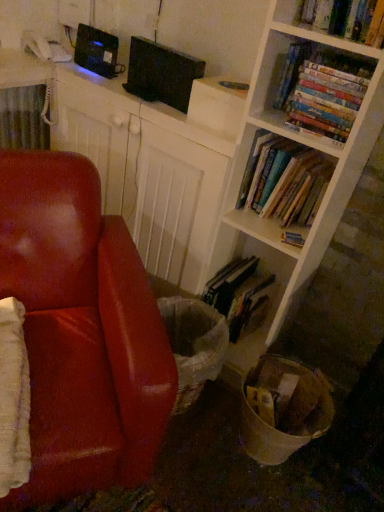
Locate an element on the screen. This screenshot has width=384, height=512. hardcover book at center, which ranks as the third book in top-to-bottom order is located at coordinates (292, 239).

The width and height of the screenshot is (384, 512). In order to click on hardcover books at upper right, acting as the fourth book starting from the bottom in this screenshot , I will do `click(322, 89)`.

Describe the element at coordinates (81, 330) in the screenshot. I see `leather at left` at that location.

Describe the element at coordinates (287, 181) in the screenshot. This screenshot has width=384, height=512. I see `hardcover books at center right, arranged as the 2th book when viewed from the top` at that location.

I want to click on black matte computer at upper center, so (x=152, y=165).

What are the coordinates of `computer above the hardcover book at center, the second book in the bottom-to-top sequence (from the image's perspective)` in the screenshot? It's located at (152, 165).

Is hardcover book at center, the second book in the bottom-to-top sequence, located outside black matte computer at upper center?

That's correct, hardcover book at center, the second book in the bottom-to-top sequence, is outside of black matte computer at upper center.

From the image's perspective, relative to black matte computer at upper center, is hardcover book at center, which ranks as the third book in top-to-bottom order, above or below?

From the image's perspective, hardcover book at center, which ranks as the third book in top-to-bottom order, appears below black matte computer at upper center.

Looking at this image, from a real-world perspective, which is physically below, hardcover book at center, the second book in the bottom-to-top sequence, or black matte computer at upper center?

black matte computer at upper center, from a real-world perspective.

From a real-world perspective, is hardcover book at lower center, the first book positioned from the bottom, beneath black matte computer at upper center?

Yes, from a real-world perspective, hardcover book at lower center, the first book positioned from the bottom, is below black matte computer at upper center.

Would you say hardcover book at lower center, which is the 4th book from top to bottom, is inside or outside black matte computer at upper center?

hardcover book at lower center, which is the 4th book from top to bottom, is not inside black matte computer at upper center, it's outside.

The width and height of the screenshot is (384, 512). In order to click on computer in front of the hardcover book at lower center, which is the 4th book from top to bottom in this screenshot , I will do `click(152, 165)`.

Is point (221, 273) closer to viewer compared to point (98, 170)?

No, it is not.

Is leather at left in contact with hardcover book at center, the second book in the bottom-to-top sequence?

leather at left and hardcover book at center, the second book in the bottom-to-top sequence, are not in contact.

At what (x,y) coordinates should I click in order to perform the action: click on chair to the left of hardcover book at center, which ranks as the third book in top-to-bottom order. Please return your answer as a coordinate pair (x, y). Looking at the image, I should click on (81, 330).

Is leather at left at the right side of hardcover book at center, the second book in the bottom-to-top sequence?

No.

Considering the relative positions of leather at left and hardcover book at center, the second book in the bottom-to-top sequence, in the image provided, is leather at left behind hardcover book at center, the second book in the bottom-to-top sequence,?

That is False.

Would you consider hardcover books at upper right, which appears as the 1th book when viewed from the top, to be distant from black matte computer at upper center?

Actually, hardcover books at upper right, which appears as the 1th book when viewed from the top, and black matte computer at upper center are a little close together.

Which is in front, point (292, 69) or point (164, 271)?

The point (292, 69) is closer to the camera.

Could you tell me if hardcover books at upper right, which appears as the 1th book when viewed from the top, is turned towards black matte computer at upper center?

No, hardcover books at upper right, which appears as the 1th book when viewed from the top, is not facing towards black matte computer at upper center.

Considering the relative sizes of hardcover books at upper right, which appears as the 1th book when viewed from the top, and hardcover books at center right, arranged as the 2th book when viewed from the top, in the image provided, is hardcover books at upper right, which appears as the 1th book when viewed from the top, taller than hardcover books at center right, arranged as the 2th book when viewed from the top,?

No.

Between hardcover books at upper right, acting as the fourth book starting from the bottom, and hardcover books at center right, which is counted as the third book, starting from the bottom, which one appears on the right side from the viewer's perspective?

hardcover books at upper right, acting as the fourth book starting from the bottom, is more to the right.

Would you say hardcover books at upper right, which appears as the 1th book when viewed from the top, contains hardcover books at center right, arranged as the 2th book when viewed from the top?

No, hardcover books at center right, arranged as the 2th book when viewed from the top, is located outside of hardcover books at upper right, which appears as the 1th book when viewed from the top.

Considering the positions of point (352, 111) and point (266, 144), is point (352, 111) closer or farther from the camera than point (266, 144)?

Point (352, 111) is closer to the camera than point (266, 144).

Between hardcover books at upper right, acting as the fourth book starting from the bottom, and hardcover book at lower center, which is the 4th book from top to bottom, which one is positioned in front?

hardcover books at upper right, acting as the fourth book starting from the bottom, is more forward.

Can you tell me how much hardcover books at upper right, which appears as the 1th book when viewed from the top, and hardcover book at lower center, which is the 4th book from top to bottom, differ in facing direction?

The facing directions of hardcover books at upper right, which appears as the 1th book when viewed from the top, and hardcover book at lower center, which is the 4th book from top to bottom, are 0.00114 degrees apart.

Who is taller, hardcover books at upper right, acting as the fourth book starting from the bottom, or hardcover book at lower center, which is the 4th book from top to bottom?

With more height is hardcover book at lower center, which is the 4th book from top to bottom.

Who is bigger, hardcover books at upper right, acting as the fourth book starting from the bottom, or hardcover book at lower center, the first book positioned from the bottom?

With larger size is hardcover book at lower center, the first book positioned from the bottom.

Considering the relative positions of leather at left and hardcover books at upper right, acting as the fourth book starting from the bottom, in the image provided, is leather at left to the left of hardcover books at upper right, acting as the fourth book starting from the bottom, from the viewer's perspective?

Correct, you'll find leather at left to the left of hardcover books at upper right, acting as the fourth book starting from the bottom.

Is point (93, 428) positioned after point (362, 68)?

No.

What's the angular difference between leather at left and hardcover books at upper right, which appears as the 1th book when viewed from the top,'s facing directions?

The angular difference between leather at left and hardcover books at upper right, which appears as the 1th book when viewed from the top, is 52.7 degrees.

Does leather at left have a larger size compared to hardcover books at upper right, which appears as the 1th book when viewed from the top?

Correct, leather at left is larger in size than hardcover books at upper right, which appears as the 1th book when viewed from the top.

From a real-world perspective, starting from the black matte computer at upper center, which book is the 1st one vertically above it? Please provide its 2D coordinates.

[(292, 239)]

This screenshot has width=384, height=512. Find the location of `book that is the 2nd one when counting downward from the black matte computer at upper center (from the image's perspective)`. book that is the 2nd one when counting downward from the black matte computer at upper center (from the image's perspective) is located at coordinates (240, 295).

Considering their positions, is leather at left positioned further to hardcover books at upper right, which appears as the 1th book when viewed from the top, than black matte computer at upper center?

leather at left lies further to hardcover books at upper right, which appears as the 1th book when viewed from the top, than the other object.

Estimate the real-world distances between objects in this image. Which object is closer to black matte computer at upper center, hardcover books at center right, which is counted as the third book, starting from the bottom, or hardcover book at center, which ranks as the third book in top-to-bottom order?

Based on the image, hardcover books at center right, which is counted as the third book, starting from the bottom, appears to be nearer to black matte computer at upper center.

From the image, which object appears to be nearer to hardcover book at center, which ranks as the third book in top-to-bottom order, hardcover books at upper right, acting as the fourth book starting from the bottom, or black matte computer at upper center?

hardcover books at upper right, acting as the fourth book starting from the bottom, is closer to hardcover book at center, which ranks as the third book in top-to-bottom order.

From the image, which object appears to be nearer to hardcover books at upper right, which appears as the 1th book when viewed from the top, black matte computer at upper center or hardcover book at lower center, the first book positioned from the bottom?

The object closer to hardcover books at upper right, which appears as the 1th book when viewed from the top, is black matte computer at upper center.

Estimate the real-world distances between objects in this image. Which object is further from leather at left, hardcover book at lower center, which is the 4th book from top to bottom, or black matte computer at upper center?

hardcover book at lower center, which is the 4th book from top to bottom, is positioned further to the anchor leather at left.

Considering their positions, is hardcover book at center, which ranks as the third book in top-to-bottom order, positioned closer to hardcover book at lower center, which is the 4th book from top to bottom, than hardcover books at upper right, which appears as the 1th book when viewed from the top?

hardcover book at center, which ranks as the third book in top-to-bottom order, is closer to hardcover book at lower center, which is the 4th book from top to bottom.

Based on their spatial positions, is hardcover books at upper right, acting as the fourth book starting from the bottom, or hardcover book at lower center, which is the 4th book from top to bottom, closer to hardcover book at center, the second book in the bottom-to-top sequence?

Among the two, hardcover book at lower center, which is the 4th book from top to bottom, is located nearer to hardcover book at center, the second book in the bottom-to-top sequence.

Considering their positions, is hardcover book at lower center, the first book positioned from the bottom, positioned closer to leather at left than hardcover books at upper right, which appears as the 1th book when viewed from the top?

Based on the image, hardcover book at lower center, the first book positioned from the bottom, appears to be nearer to leather at left.

Locate an element on the screen. The width and height of the screenshot is (384, 512). book between hardcover books at upper right, acting as the fourth book starting from the bottom, and hardcover book at center, which ranks as the third book in top-to-bottom order, in the vertical direction is located at coordinates (287, 181).

Identify the location of computer situated between leather at left and hardcover books at upper right, acting as the fourth book starting from the bottom, from left to right. (152, 165).

What are the coordinates of `computer between leather at left and hardcover books at center right, arranged as the 2th book when viewed from the top` in the screenshot? It's located at (152, 165).

You are a GUI agent. You are given a task and a screenshot of the screen. Output one action in this format:
    pyautogui.click(x=<x>, y=<y>)
    Task: Click on the book between hardcover books at center right, arranged as the 2th book when viewed from the top, and hardcover book at lower center, which is the 4th book from top to bottom, vertically
    
    Given the screenshot: What is the action you would take?
    pyautogui.click(x=292, y=239)